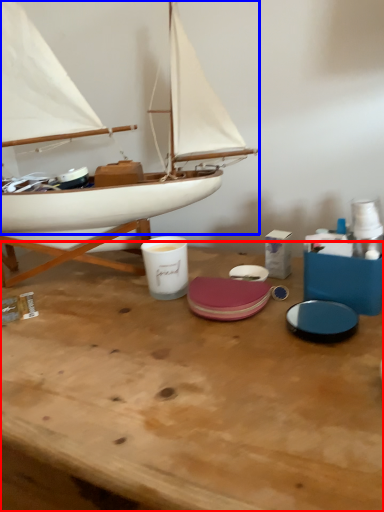
Question: Among these objects, which one is nearest to the camera, table (highlighted by a red box) or boat (highlighted by a blue box)?

Choices:
 (A) table
 (B) boat

Answer: (A)